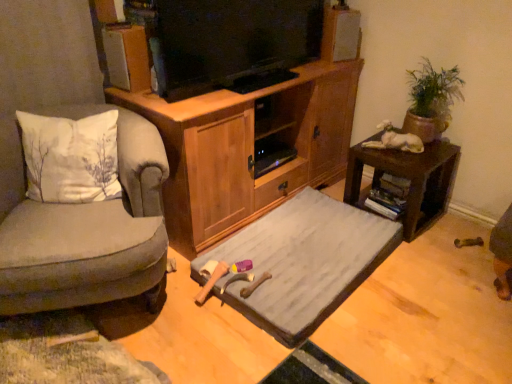
Identify the location of wooden cabinet at center. (247, 149).

What do you see at coordinates (409, 180) in the screenshot? I see `brown wooden desk at right` at bounding box center [409, 180].

Describe the element at coordinates (70, 157) in the screenshot. I see `white cotton pillow at left` at that location.

Where is `velvet grey armchair at left`? The width and height of the screenshot is (512, 384). velvet grey armchair at left is located at coordinates (90, 232).

Is wooden cabinet at center wider than green clay pot at upper right?

Indeed, wooden cabinet at center has a greater width compared to green clay pot at upper right.

From a real-world perspective, is wooden cabinet at center beneath green clay pot at upper right?

Correct, in the physical world, wooden cabinet at center is lower than green clay pot at upper right.

Measure the distance between wooden cabinet at center and green clay pot at upper right.

wooden cabinet at center and green clay pot at upper right are 26.87 inches apart from each other.

Between wooden cabinet at center and green clay pot at upper right, which one has less height?

With less height is green clay pot at upper right.

Measure the distance from velvet grey armchair at left to wooden cabinet at center.

21.39 inches.

Choose the correct answer: Is velvet grey armchair at left inside wooden cabinet at center or outside it?

velvet grey armchair at left cannot be found inside wooden cabinet at center.

The width and height of the screenshot is (512, 384). In order to click on cabinetry that is behind the velvet grey armchair at left in this screenshot , I will do `click(247, 149)`.

Considering the sizes of objects velvet grey armchair at left and wooden cabinet at center in the image provided, who is bigger, velvet grey armchair at left or wooden cabinet at center?

With larger size is wooden cabinet at center.

Locate an element on the screen. pillow above the brown wooden desk at right (from the image's perspective) is located at coordinates (70, 157).

Is brown wooden desk at right located within white cotton pillow at left?

No, brown wooden desk at right is not surrounded by white cotton pillow at left.

Based on their sizes in the image, would you say white cotton pillow at left is bigger or smaller than brown wooden desk at right?

Considering their sizes, white cotton pillow at left takes up less space than brown wooden desk at right.

Is point (430, 83) closer or farther from the camera than point (349, 221)?

Point (430, 83) appears to be closer to the viewer than point (349, 221).

In the image, is green clay pot at upper right on the left side or the right side of gray fabric bed at center?

Clearly, green clay pot at upper right is on the right of gray fabric bed at center in the image.

From the image's perspective, is green clay pot at upper right located above gray fabric bed at center?

Correct, green clay pot at upper right appears higher than gray fabric bed at center in the image.

Is green clay pot at upper right oriented away from gray fabric bed at center?

No, green clay pot at upper right is not facing the opposite direction of gray fabric bed at center.

This screenshot has height=384, width=512. Find the location of `pillow in front of the brown wooden desk at right`. pillow in front of the brown wooden desk at right is located at coordinates (70, 157).

From the image's perspective, is brown wooden desk at right above or below white cotton pillow at left?

Based on their image positions, brown wooden desk at right is located beneath white cotton pillow at left.

Is brown wooden desk at right taller than white cotton pillow at left?

No, brown wooden desk at right is not taller than white cotton pillow at left.

Is point (417, 217) positioned in front of point (79, 167)?

No, it is not.

Find the location of a particular element. Image resolution: width=512 pixels, height=384 pixels. bed frame in front of the wooden cabinet at center is located at coordinates (303, 262).

Considering the relative sizes of wooden cabinet at center and gray fabric bed at center in the image provided, is wooden cabinet at center bigger than gray fabric bed at center?

Yes, wooden cabinet at center is bigger than gray fabric bed at center.

Is gray fabric bed at center a part of wooden cabinet at center?

Definitely not — gray fabric bed at center is not inside wooden cabinet at center.

Which is closer, [404,240] or [413,90]?

The point [404,240] is more forward.

Considering the relative positions of brown wooden desk at right and green clay pot at upper right in the image provided, is brown wooden desk at right behind green clay pot at upper right?

Yes, brown wooden desk at right is behind green clay pot at upper right.

Is green clay pot at upper right located within brown wooden desk at right?

No, green clay pot at upper right is located outside of brown wooden desk at right.

From the image's perspective, who appears lower, brown wooden desk at right or green clay pot at upper right?

brown wooden desk at right is shown below in the image.

Where is `cabinetry in front of the green clay pot at upper right`? cabinetry in front of the green clay pot at upper right is located at coordinates (247, 149).

What are the coordinates of `cabinetry above the velvet grey armchair at left (from a real-world perspective)` in the screenshot? It's located at (247, 149).

When comparing their distances from green clay pot at upper right, does white cotton pillow at left or wooden cabinet at center seem closer?

The object closer to green clay pot at upper right is wooden cabinet at center.

Based on their spatial positions, is brown wooden desk at right or white cotton pillow at left further from velvet grey armchair at left?

brown wooden desk at right is positioned further to the anchor velvet grey armchair at left.

Looking at the image, which one is located closer to green clay pot at upper right, gray fabric bed at center or white cotton pillow at left?

Based on the image, gray fabric bed at center appears to be nearer to green clay pot at upper right.

Which object lies further to the anchor point velvet grey armchair at left, white cotton pillow at left or brown wooden desk at right?

Among the two, brown wooden desk at right is located further to velvet grey armchair at left.

Looking at the image, which one is located closer to brown wooden desk at right, green clay pot at upper right or velvet grey armchair at left?

Based on the image, green clay pot at upper right appears to be nearer to brown wooden desk at right.

Looking at the image, which one is located closer to velvet grey armchair at left, gray fabric bed at center or wooden cabinet at center?

wooden cabinet at center.

Which object lies nearer to the anchor point wooden cabinet at center, brown wooden desk at right or green clay pot at upper right?

brown wooden desk at right.

When comparing their distances from velvet grey armchair at left, does brown wooden desk at right or gray fabric bed at center seem closer?

Based on the image, gray fabric bed at center appears to be nearer to velvet grey armchair at left.

Find the location of `bed frame between wooden cabinet at center and green clay pot at upper right from left to right`. bed frame between wooden cabinet at center and green clay pot at upper right from left to right is located at coordinates (303, 262).

Locate an element on the screen. The height and width of the screenshot is (384, 512). cabinetry between velvet grey armchair at left and brown wooden desk at right in the horizontal direction is located at coordinates (247, 149).

Locate an element on the screen. The height and width of the screenshot is (384, 512). bed frame between wooden cabinet at center and brown wooden desk at right from left to right is located at coordinates (303, 262).

What are the coordinates of `pillow between velvet grey armchair at left and brown wooden desk at right` in the screenshot? It's located at (70, 157).